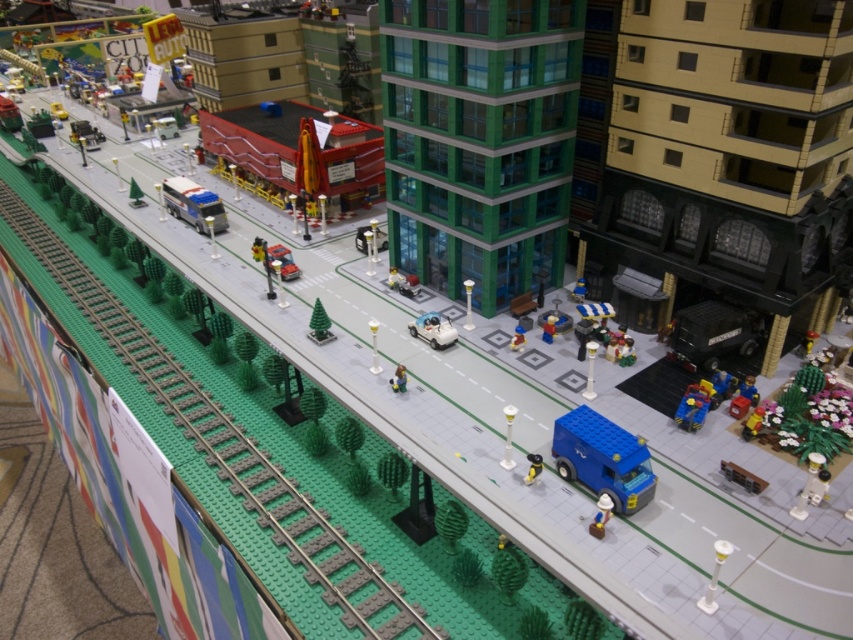
You are navigating a Lego city and need to locate the matte blue bus at center. According to the coordinates provided, where exactly is the matte blue bus positioned in the scene?

The matte blue bus at center is located at point coordinates (193,204).

In the scene shown: You are a Lego figure standing at the point with coordinates point (521,332). You want to look towards the point with coordinates point (553,330). In which direction should you turn your head to see it?

Point (553,330) is behind point (521,332), so you should turn your head backward to see it.